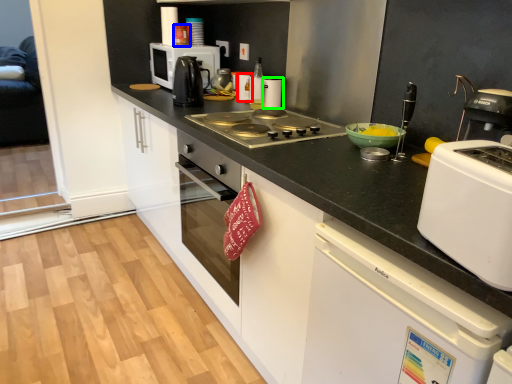
Question: Which object is positioned farthest from kitchen appliance (highlighted by a red box)? Select from kitchen appliance (highlighted by a blue box) and kitchen appliance (highlighted by a green box).

Choices:
 (A) kitchen appliance
 (B) kitchen appliance

Answer: (A)